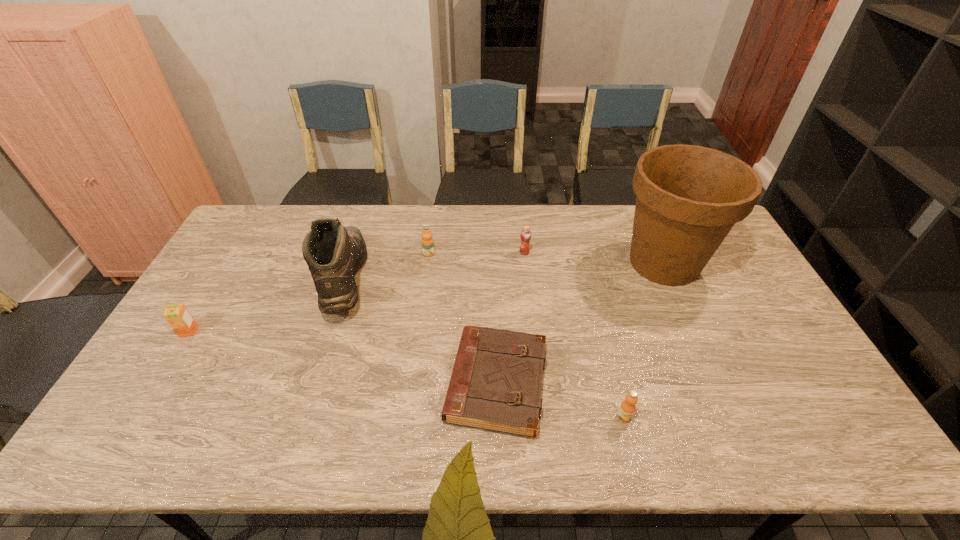
At what (x,y) coordinates should I click in order to perform the action: click on free space that is in between the rightmost orange juice and the leftmost orange juice. Please return your answer as a coordinate pair (x, y). This screenshot has height=540, width=960. Looking at the image, I should click on (406, 374).

At what (x,y) coordinates should I click in order to perform the action: click on unoccupied position between the third orange juice from left to right and the shortest object. Please return your answer as a coordinate pair (x, y). The height and width of the screenshot is (540, 960). Looking at the image, I should click on (511, 319).

This screenshot has width=960, height=540. I want to click on unoccupied position between the hardback book and the fifth object from right to left, so [463, 319].

Identify the location of free space between the hardback book and the rightmost object. The height and width of the screenshot is (540, 960). (581, 323).

The width and height of the screenshot is (960, 540). Find the location of `free space between the tallest object and the fifth object from right to left`. free space between the tallest object and the fifth object from right to left is located at coordinates (546, 258).

This screenshot has height=540, width=960. In order to click on free spot between the second object from right to left and the hardback book in this screenshot , I will do `click(561, 401)`.

At what (x,y) coordinates should I click in order to perform the action: click on vacant space in between the hardback book and the rightmost object. Please return your answer as a coordinate pair (x, y). Image resolution: width=960 pixels, height=540 pixels. Looking at the image, I should click on (581, 323).

The image size is (960, 540). I want to click on empty location between the leftmost orange juice and the flowerpot, so click(426, 297).

At what (x,y) coordinates should I click in order to perform the action: click on object that is the third closest to the sixth shortest object. Please return your answer as a coordinate pair (x, y). Looking at the image, I should click on 178,316.

Identify which object is the third nearest to the second tallest object. Please provide its 2D coordinates. Your answer should be formatted as a tuple, i.e. [(x, y)], where the tuple contains the x and y coordinates of a point satisfying the conditions above.

[(178, 316)]